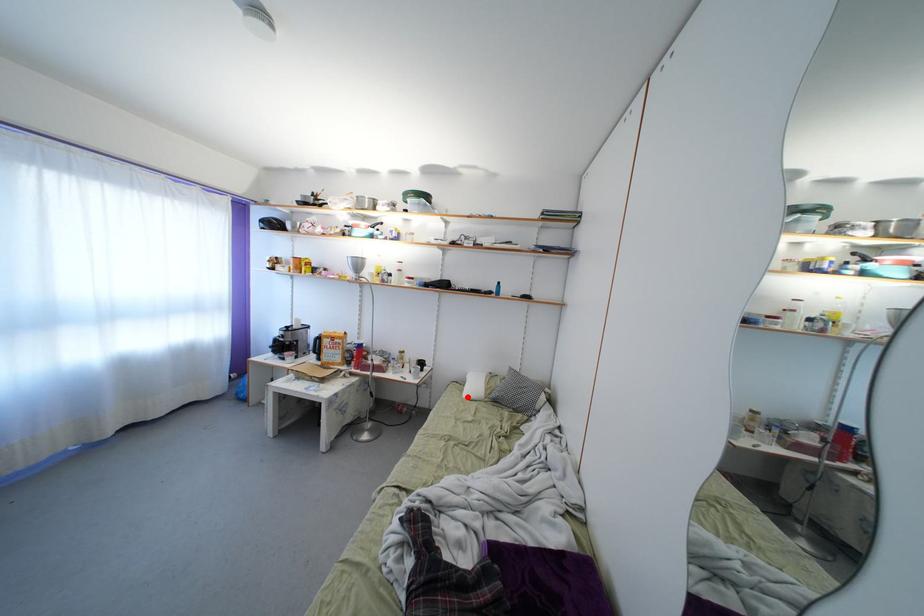
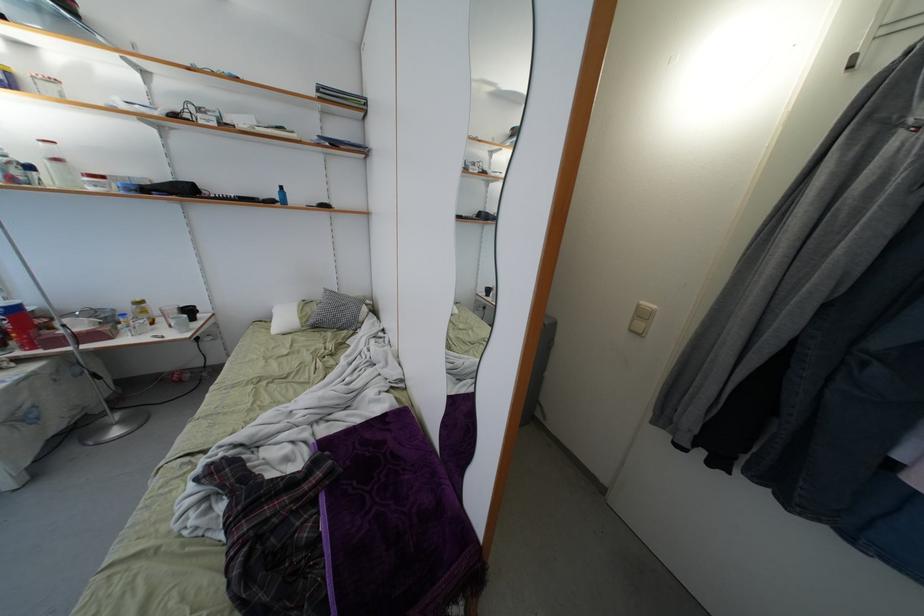
Find the pixel in the second image that matches the highlighted location in the first image.

(274, 334)